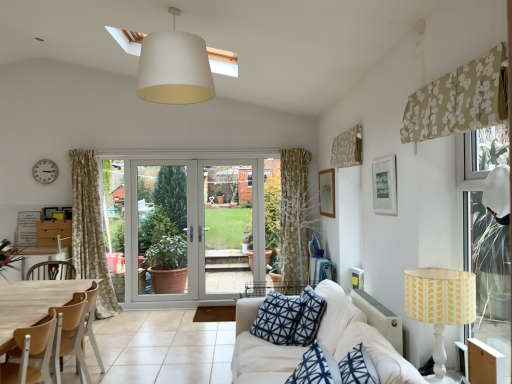
This screenshot has height=384, width=512. Identify the location of white plastic screen door at center. (163, 228).

What do you see at coordinates (360, 337) in the screenshot? I see `white fabric couch at lower right` at bounding box center [360, 337].

Where is `silver metallic clock at upper left`? The image size is (512, 384). silver metallic clock at upper left is located at coordinates (45, 171).

This screenshot has height=384, width=512. What do you see at coordinates (347, 148) in the screenshot?
I see `floral fabric curtain at upper right, marked as the first curtain in a back-to-front arrangement` at bounding box center [347, 148].

You are a GUI agent. You are given a task and a screenshot of the screen. Output one action in this format:
    pyautogui.click(x=<x>, y=<y>)
    Task: Click on the floral fabric curtain at upper right, the second curtain positioned from the front
    
    Given the screenshot: What is the action you would take?
    pyautogui.click(x=347, y=148)

Measure the distance between point (45, 363) and camera.

Point (45, 363) and camera are 8.96 feet apart.

Locate an element on the screen. The image size is (512, 384). white plastic screen door at center is located at coordinates (163, 228).

How distant is silver metallic clock at upper left from wooden chair at left?

silver metallic clock at upper left is 3.01 meters away from wooden chair at left.

Is silver metallic clock at upper left not inside wooden chair at left?

Yes.

Which object is closer to the camera taking this photo, silver metallic clock at upper left or wooden chair at left?

wooden chair at left is more forward.

Considering the relative sizes of white fabric lampshade at upper center and wooden chair at left in the image provided, is white fabric lampshade at upper center thinner than wooden chair at left?

No.

Is white fabric lampshade at upper center inside or outside of wooden chair at left?

white fabric lampshade at upper center is not inside wooden chair at left, it's outside.

Would you say matte white picture frame at upper right, the first picture frame in the right-to-left sequence, is outside white fabric lampshade at upper center?

Indeed, matte white picture frame at upper right, the first picture frame in the right-to-left sequence, is completely outside white fabric lampshade at upper center.

Looking at this image, can you confirm if matte white picture frame at upper right, the first picture frame in the right-to-left sequence, is positioned to the left of white fabric lampshade at upper center?

In fact, matte white picture frame at upper right, the first picture frame in the right-to-left sequence, is to the right of white fabric lampshade at upper center.

Is matte white picture frame at upper right, the second picture frame in the back-to-front sequence, wider than white fabric lampshade at upper center?

In fact, matte white picture frame at upper right, the second picture frame in the back-to-front sequence, might be narrower than white fabric lampshade at upper center.

Which object is closer to the camera, matte white picture frame at upper right, which is counted as the second picture frame, starting from the left, or white fabric lampshade at upper center?

white fabric lampshade at upper center.

Which object is more forward, wooden picture frame at upper right, which appears as the first picture frame when viewed from the back, or floral fabric curtain at upper right, marked as the first curtain in a back-to-front arrangement?

Positioned in front is floral fabric curtain at upper right, marked as the first curtain in a back-to-front arrangement.

What's the angular difference between wooden picture frame at upper right, which is the 1th picture frame in left-to-right order, and floral fabric curtain at upper right, marked as the first curtain in a back-to-front arrangement,'s facing directions?

wooden picture frame at upper right, which is the 1th picture frame in left-to-right order, and floral fabric curtain at upper right, marked as the first curtain in a back-to-front arrangement, are facing 0.184 degrees away from each other.

Can you confirm if wooden picture frame at upper right, the second picture frame when ordered from front to back, is bigger than floral fabric curtain at upper right, the second curtain positioned from the front?

No, wooden picture frame at upper right, the second picture frame when ordered from front to back, is not bigger than floral fabric curtain at upper right, the second curtain positioned from the front.

Between wooden picture frame at upper right, placed as the 2th picture frame when sorted from right to left, and floral fabric curtain at upper right, marked as the first curtain in a back-to-front arrangement, which one appears on the right side from the viewer's perspective?

floral fabric curtain at upper right, marked as the first curtain in a back-to-front arrangement.

In terms of height, does white plastic screen door at center look taller or shorter compared to silver metallic clock at upper left?

Considering their sizes, white plastic screen door at center has more height than silver metallic clock at upper left.

The image size is (512, 384). I want to click on screen door behind the silver metallic clock at upper left, so click(163, 228).

From the image's perspective, which is below, white plastic screen door at center or silver metallic clock at upper left?

white plastic screen door at center is shown below in the image.

From a real-world perspective, is white plastic screen door at center positioned above or below silver metallic clock at upper left?

white plastic screen door at center is situated lower than silver metallic clock at upper left in the real world.

Is wooden picture frame at upper right, the second picture frame when ordered from front to back, beside white plastic screen door at center?

No, wooden picture frame at upper right, the second picture frame when ordered from front to back, is not beside white plastic screen door at center.

Could you tell me if wooden picture frame at upper right, the second picture frame when ordered from front to back, is facing white plastic screen door at center?

Yes.

Is wooden picture frame at upper right, which appears as the first picture frame when viewed from the back, to the right of white plastic screen door at center from the viewer's perspective?

Indeed, wooden picture frame at upper right, which appears as the first picture frame when viewed from the back, is positioned on the right side of white plastic screen door at center.

Considering the positions of points (325, 194) and (167, 192), is point (325, 194) farther from camera compared to point (167, 192)?

No, (325, 194) is closer to viewer.

Considering the positions of objects white fabric lampshade at upper center and floral fabric curtain at upper right, the second curtain positioned from the front, in the image provided, who is behind, white fabric lampshade at upper center or floral fabric curtain at upper right, the second curtain positioned from the front,?

Positioned behind is floral fabric curtain at upper right, the second curtain positioned from the front.

Considering the relative sizes of white fabric lampshade at upper center and floral fabric curtain at upper right, marked as the first curtain in a back-to-front arrangement, in the image provided, is white fabric lampshade at upper center thinner than floral fabric curtain at upper right, marked as the first curtain in a back-to-front arrangement,?

No.

In terms of size, does white fabric lampshade at upper center appear bigger or smaller than floral fabric curtain at upper right, the second curtain positioned from the front?

white fabric lampshade at upper center is bigger than floral fabric curtain at upper right, the second curtain positioned from the front.

Where is `chair below the silver metallic clock at upper left (from a real-world perspective)`? This screenshot has width=512, height=384. chair below the silver metallic clock at upper left (from a real-world perspective) is located at coordinates (53, 341).

Find the location of a particular element. chair behind the white fabric lampshade at upper center is located at coordinates (53, 341).

Estimate the real-world distances between objects in this image. Which object is closer to white plastic screen door at center, silver metallic clock at upper left or wooden chair at left?

Among the two, silver metallic clock at upper left is located nearer to white plastic screen door at center.

Considering their positions, is white plastic screen door at center positioned closer to wooden chair at left than white fabric couch at lower right?

white fabric couch at lower right is positioned closer to the anchor wooden chair at left.

Looking at the image, which one is located further to wooden picture frame at upper right, which is the 1th picture frame in left-to-right order, yellow fabric lampshade at right or matte white picture frame at upper right, which is counted as the second picture frame, starting from the left?

Based on the image, yellow fabric lampshade at right appears to be further to wooden picture frame at upper right, which is the 1th picture frame in left-to-right order.

Considering their positions, is white fabric lampshade at upper center positioned further to matte white picture frame at upper right, which ranks as the 1th picture frame in front-to-back order, than beige floral fabric at upper right, which ranks as the 1th curtain in front-to-back order?

white fabric lampshade at upper center is positioned further to the anchor matte white picture frame at upper right, which ranks as the 1th picture frame in front-to-back order.

In the scene shown: Considering their positions, is white plastic screen door at center positioned further to beige floral fabric at upper right, the second curtain when ordered from back to front, than yellow fabric lampshade at right?

Among the two, white plastic screen door at center is located further to beige floral fabric at upper right, the second curtain when ordered from back to front.

From the image, which object appears to be farther from silver metallic clock at upper left, white fabric couch at lower right or wooden picture frame at upper right, which is the 1th picture frame in left-to-right order?

white fabric couch at lower right lies further to silver metallic clock at upper left than the other object.

Estimate the real-world distances between objects in this image. Which object is closer to white glossy door at center, wooden picture frame at upper right, placed as the 2th picture frame when sorted from right to left, or beige floral fabric at upper right, the second curtain when ordered from back to front?

The object closer to white glossy door at center is wooden picture frame at upper right, placed as the 2th picture frame when sorted from right to left.

Considering their positions, is wooden chair at left positioned closer to silver metallic clock at upper left than white plastic screen door at center?

white plastic screen door at center lies closer to silver metallic clock at upper left than the other object.

Locate an element on the screen. Image resolution: width=512 pixels, height=384 pixels. table lamp located between beige floral fabric at upper right, the second curtain when ordered from back to front, and wooden picture frame at upper right, the second picture frame when ordered from front to back, in the depth direction is located at coordinates (440, 304).

Where is `chair between yellow fabric lampshade at right and white plastic screen door at center from front to back`? The height and width of the screenshot is (384, 512). chair between yellow fabric lampshade at right and white plastic screen door at center from front to back is located at coordinates (53, 341).

In order to click on curtain between wooden chair at left and beige floral fabric at upper right, which ranks as the 1th curtain in front-to-back order, in the horizontal direction in this screenshot , I will do `click(347, 148)`.

Locate an element on the screen. The width and height of the screenshot is (512, 384). table lamp between white fabric couch at lower right and white glossy door at center from front to back is located at coordinates (440, 304).